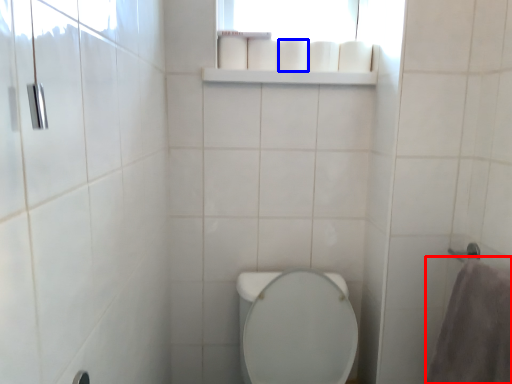
Question: Which object appears closest to the camera in this image, bath towel (highlighted by a red box) or toilet paper (highlighted by a blue box)?

Choices:
 (A) bath towel
 (B) toilet paper

Answer: (A)